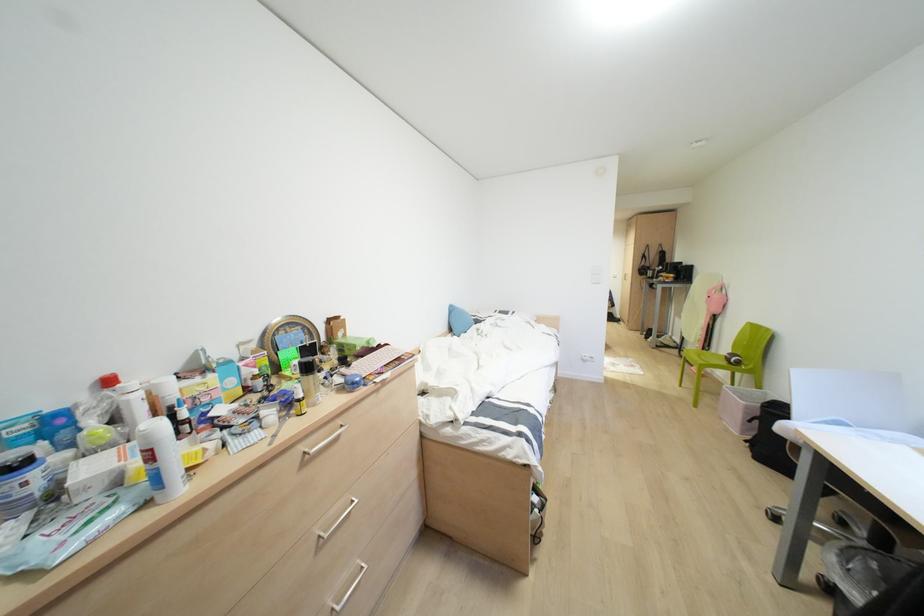
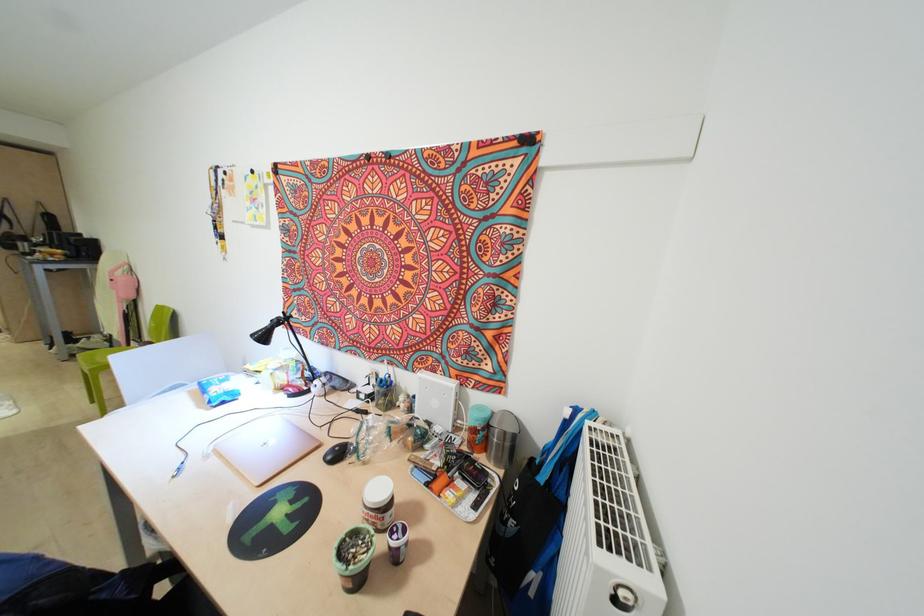
Question: The images are taken continuously from a first-person perspective. In which direction is your viewpoint rotating?

Choices:
 (A) Left
 (B) Right
 (C) Up
 (D) Down

Answer: (B)